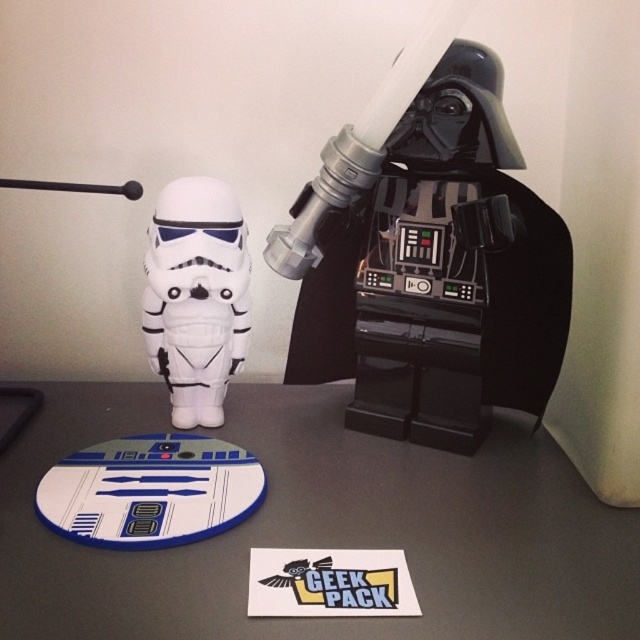
Question: Estimate the real-world distances between objects in this image. Which object is farther from the black plastic darth vader at upper right?

Choices:
 (A) white matte stormtrooper at center
 (B) white matte mouse pad at center

Answer: (A)

Question: Estimate the real-world distances between objects in this image. Which object is farther from the white matte stormtrooper at center?

Choices:
 (A) white matte mouse pad at center
 (B) black plastic darth vader at upper right

Answer: (A)

Question: Can you confirm if black plastic darth vader at upper right is positioned to the right of white matte stormtrooper at center?

Choices:
 (A) yes
 (B) no

Answer: (A)

Question: Does black plastic darth vader at upper right lie behind white matte stormtrooper at center?

Choices:
 (A) yes
 (B) no

Answer: (B)

Question: Which of these objects is positioned closest to the white matte mouse pad at center?

Choices:
 (A) black plastic darth vader at upper right
 (B) white matte stormtrooper at center

Answer: (A)

Question: Is white matte mouse pad at center below white matte stormtrooper at center?

Choices:
 (A) yes
 (B) no

Answer: (A)